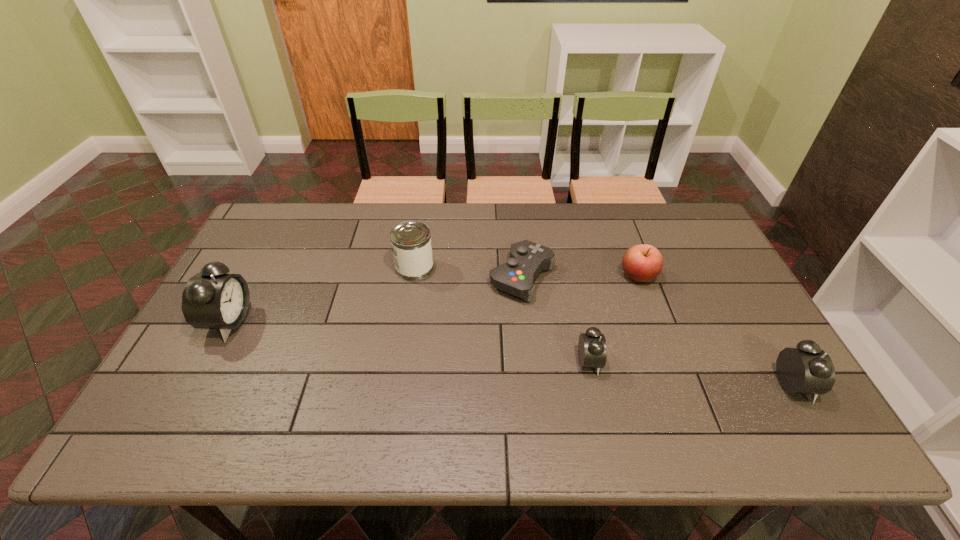
This screenshot has width=960, height=540. I want to click on free space located on the front side of the leftmost alarm clock, so click(276, 321).

Where is `vacant space located 0.390m on the front side of the third object from right to left`? vacant space located 0.390m on the front side of the third object from right to left is located at coordinates (756, 362).

At what (x,y) coordinates should I click in order to perform the action: click on free space located on the right of the control. Please return your answer as a coordinate pair (x, y). The width and height of the screenshot is (960, 540). Looking at the image, I should click on (636, 277).

The image size is (960, 540). I want to click on free spot located 0.340m on the front of the fifth object from right to left, so click(397, 379).

At what (x,y) coordinates should I click in order to perform the action: click on free space located on the front of the fifth object from left to right. Please return your answer as a coordinate pair (x, y). Image resolution: width=960 pixels, height=540 pixels. Looking at the image, I should click on (685, 402).

Identify the location of object that is at the left edge. (212, 299).

Identify the location of object that is at the right edge. The height and width of the screenshot is (540, 960). (807, 369).

The image size is (960, 540). What are the coordinates of `object that is at the near right corner` in the screenshot? It's located at (807, 369).

Identify the location of free space at the far edge of the desktop. The width and height of the screenshot is (960, 540). (481, 241).

The height and width of the screenshot is (540, 960). Identify the location of vacant space at the near edge of the desktop. (499, 382).